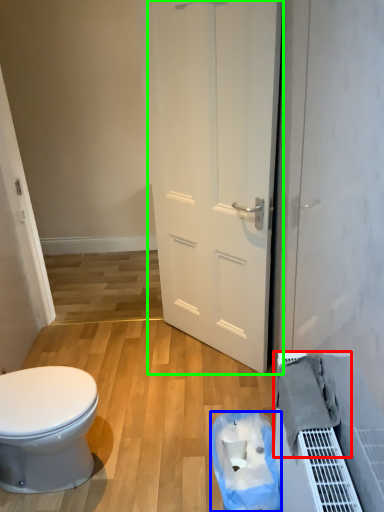
Question: Estimate the real-world distances between objects in this image. Which object is farther from material (highlighted by a red box), garbage (highlighted by a blue box) or door (highlighted by a green box)?

Choices:
 (A) garbage
 (B) door

Answer: (B)